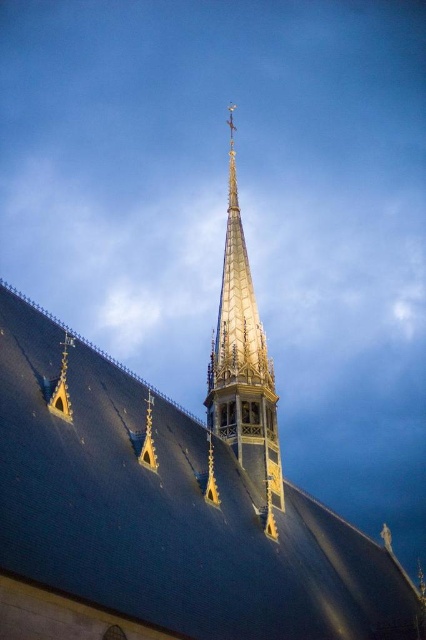
Can you confirm if shiny dark gray roof at center is shorter than golden-gilt spire at upper center?

Correct, shiny dark gray roof at center is not as tall as golden-gilt spire at upper center.

I want to click on shiny dark gray roof at center, so click(164, 515).

I want to click on shiny dark gray roof at center, so click(x=164, y=515).